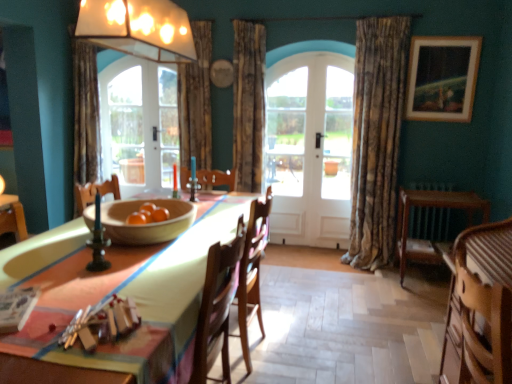
Question: Considering the positions of point (462, 322) and point (414, 248), is point (462, 322) closer or farther from the camera than point (414, 248)?

Choices:
 (A) farther
 (B) closer

Answer: (B)

Question: Relative to wooden round table at right, is wooden striped armchair at lower right in front or behind?

Choices:
 (A) front
 (B) behind

Answer: (A)

Question: Estimate the real-world distances between objects in this image. Which object is closer to the white wooden door at center?

Choices:
 (A) wooden round table at right
 (B) wooden striped armchair at lower right
 (C) wooden chair at center
 (D) clear glass door at center
 (E) wooden framed painting at upper right

Answer: (D)

Question: Estimate the real-world distances between objects in this image. Which object is farther from the wooden bowl at center?

Choices:
 (A) textured brown curtain at center, marked as the first curtain in a left-to-right arrangement
 (B) wooden striped armchair at lower right
 (C) wooden chair at center
 (D) clear glass door at center
 (E) textured brown curtain at center, marked as the second curtain in a right-to-left arrangement

Answer: (D)